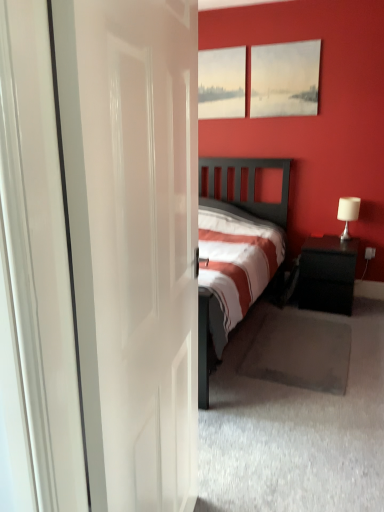
What do you see at coordinates (327, 274) in the screenshot?
I see `black glossy nightstand at right` at bounding box center [327, 274].

The image size is (384, 512). What do you see at coordinates (132, 240) in the screenshot?
I see `white glossy door at center` at bounding box center [132, 240].

Measure the distance between point [271,47] and camera.

11.54 feet.

The image size is (384, 512). What do you see at coordinates (285, 79) in the screenshot?
I see `matte canvas painting at upper center` at bounding box center [285, 79].

This screenshot has height=512, width=384. What are the coordinates of `black glossy nightstand at right` in the screenshot? It's located at (327, 274).

Is white glossy door at center further to the viewer compared to white fabric lampshade at right?

No, white glossy door at center is closer to the viewer.

Is white glossy door at center positioned with its back to white fabric lampshade at right?

No, white glossy door at center is not facing away from white fabric lampshade at right.

Is white glossy door at center directly adjacent to white fabric lampshade at right?

white glossy door at center is not next to white fabric lampshade at right, and they're not touching.

Is white glossy door at center wider than white fabric lampshade at right?

No, white glossy door at center is not wider than white fabric lampshade at right.

At what (x,y) coordinates should I click in order to perform the action: click on door below the white fabric lampshade at right (from the image's perspective). Please return your answer as a coordinate pair (x, y). Looking at the image, I should click on (132, 240).

Considering the positions of objects white fabric lampshade at right and white glossy door at center in the image provided, who is in front, white fabric lampshade at right or white glossy door at center?

white glossy door at center is more forward.

Does white fabric lampshade at right have a lesser width compared to white glossy door at center?

No, white fabric lampshade at right is not thinner than white glossy door at center.

How different are the orientations of white glossy door at center and matte canvas painting at upper center in degrees?

They differ by 98.7 degrees in their facing directions.

Which object is closer to the camera taking this photo, white glossy door at center or matte canvas painting at upper center?

Positioned in front is white glossy door at center.

Considering the sizes of objects white glossy door at center and matte canvas painting at upper center in the image provided, who is thinner, white glossy door at center or matte canvas painting at upper center?

matte canvas painting at upper center is thinner.

From the image's perspective, which is above, white glossy door at center or matte canvas painting at upper center?

matte canvas painting at upper center appears higher in the image.

Would you consider matte canvas painting at upper center to be distant from white fabric lampshade at right?

matte canvas painting at upper center is far away from white fabric lampshade at right.

Considering the relative sizes of matte canvas painting at upper center and white fabric lampshade at right in the image provided, is matte canvas painting at upper center smaller than white fabric lampshade at right?

No, matte canvas painting at upper center is not smaller than white fabric lampshade at right.

Identify the location of table lamp on the right side of matte canvas painting at upper center. (348, 213).

How different are the orientations of white fabric lampshade at right and matte white painting at upper center in degrees?

The angular difference between white fabric lampshade at right and matte white painting at upper center is 0.993 degrees.

Which object is thinner, white fabric lampshade at right or matte white painting at upper center?

With smaller width is matte white painting at upper center.

You are a GUI agent. You are given a task and a screenshot of the screen. Output one action in this format:
    pyautogui.click(x=<x>, y=<y>)
    Task: Click on the table lamp to the right of matte white painting at upper center
    The width and height of the screenshot is (384, 512).
    Given the screenshot: What is the action you would take?
    (x=348, y=213)

Is white fabric lampshade at right taller than matte white painting at upper center?

In fact, white fabric lampshade at right may be shorter than matte white painting at upper center.

From the picture: From a real-world perspective, is black glossy nightstand at right positioned under white fabric lampshade at right based on gravity?

Yes, from a real-world perspective, black glossy nightstand at right is under white fabric lampshade at right.

Is black glossy nightstand at right further to the viewer compared to white fabric lampshade at right?

No, it is in front of white fabric lampshade at right.

Considering the relative positions of black glossy nightstand at right and white fabric lampshade at right in the image provided, is black glossy nightstand at right to the left of white fabric lampshade at right from the viewer's perspective?

Correct, you'll find black glossy nightstand at right to the left of white fabric lampshade at right.

Looking at their sizes, would you say black glossy nightstand at right is wider or thinner than white fabric lampshade at right?

black glossy nightstand at right is wider than white fabric lampshade at right.

Locate an element on the screen. The width and height of the screenshot is (384, 512). picture frame to the left of black glossy nightstand at right is located at coordinates [x=285, y=79].

Measure the distance between matte canvas painting at upper center and black glossy nightstand at right.

matte canvas painting at upper center and black glossy nightstand at right are 1.43 meters apart.

How different are the orientations of matte canvas painting at upper center and black glossy nightstand at right in degrees?

matte canvas painting at upper center and black glossy nightstand at right are facing 0.994 degrees away from each other.

Is black glossy nightstand at right surrounded by matte canvas painting at upper center?

No, black glossy nightstand at right is not inside matte canvas painting at upper center.

Locate an element on the screen. table lamp behind the white glossy door at center is located at coordinates (348, 213).

The height and width of the screenshot is (512, 384). I want to click on door on the left side of white fabric lampshade at right, so click(132, 240).

Based on their spatial positions, is matte white painting at upper center or black glossy nightstand at right further from matte canvas painting at upper center?

Based on the image, black glossy nightstand at right appears to be further to matte canvas painting at upper center.

Which object lies nearer to the anchor point matte canvas painting at upper center, black glossy nightstand at right or white fabric lampshade at right?

white fabric lampshade at right lies closer to matte canvas painting at upper center than the other object.

From the image, which object appears to be nearer to matte canvas painting at upper center, white glossy door at center or matte white painting at upper center?

matte white painting at upper center.

Based on their spatial positions, is black glossy nightstand at right or matte canvas painting at upper center closer to matte white painting at upper center?

matte canvas painting at upper center.

Consider the image. Based on their spatial positions, is white fabric lampshade at right or white glossy door at center closer to black glossy nightstand at right?

Based on the image, white fabric lampshade at right appears to be nearer to black glossy nightstand at right.

Looking at the image, which one is located closer to white fabric lampshade at right, black glossy nightstand at right or matte white painting at upper center?

black glossy nightstand at right is closer to white fabric lampshade at right.

Based on their spatial positions, is matte canvas painting at upper center or matte white painting at upper center further from black glossy nightstand at right?

Based on the image, matte white painting at upper center appears to be further to black glossy nightstand at right.

When comparing their distances from matte white painting at upper center, does black glossy nightstand at right or white fabric lampshade at right seem closer?

The object closer to matte white painting at upper center is white fabric lampshade at right.

You are a GUI agent. You are given a task and a screenshot of the screen. Output one action in this format:
    pyautogui.click(x=<x>, y=<y>)
    Task: Click on the table lamp between matte canvas painting at upper center and black glossy nightstand at right vertically
    The image size is (384, 512).
    Given the screenshot: What is the action you would take?
    pyautogui.click(x=348, y=213)

I want to click on table lamp that lies between matte white painting at upper center and black glossy nightstand at right from top to bottom, so click(x=348, y=213).

The image size is (384, 512). I want to click on table lamp between white glossy door at center and matte white painting at upper center from front to back, so click(348, 213).

Image resolution: width=384 pixels, height=512 pixels. I want to click on picture frame between white glossy door at center and matte white painting at upper center from front to back, so click(285, 79).